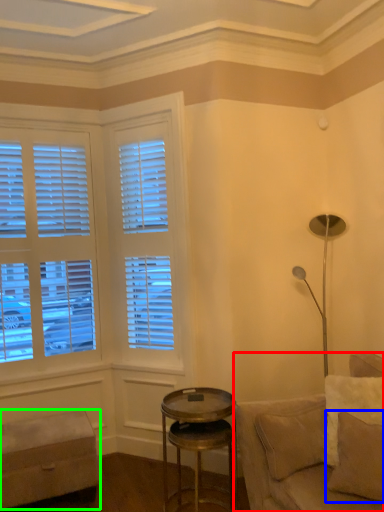
Question: Based on their relative distances, which object is nearer to studio couch (highlighted by a red box)? Choose from pillow (highlighted by a blue box) and bar stool (highlighted by a green box).

Choices:
 (A) pillow
 (B) bar stool

Answer: (A)